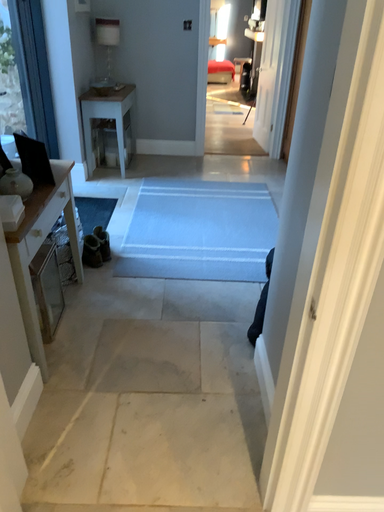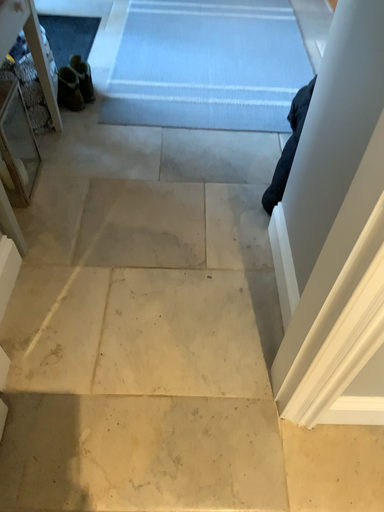
Question: How did the camera likely rotate when shooting the video?

Choices:
 (A) rotated downward
 (B) rotated upward

Answer: (A)